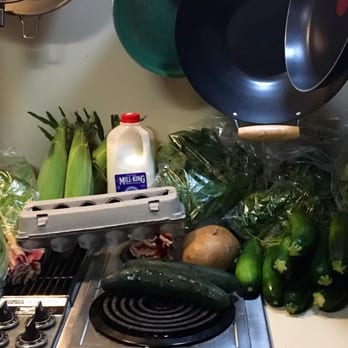
Where is `black stove top knobs`? black stove top knobs is located at coordinates (36, 311), (1, 311), (0, 335), (34, 335).